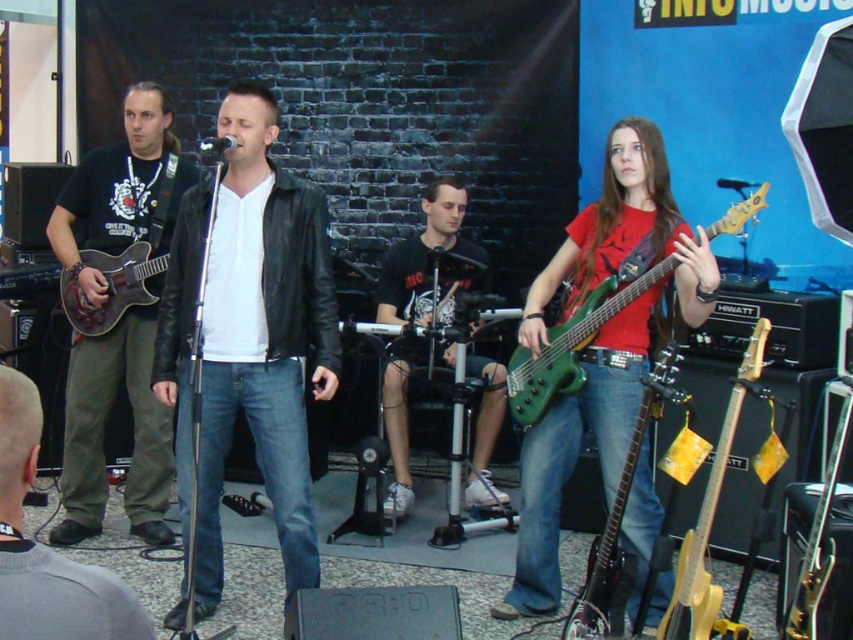
From the picture: Does black leather jacket at center have a larger size compared to green glossy bass guitar at center?

Yes, black leather jacket at center is bigger than green glossy bass guitar at center.

Who is shorter, black leather jacket at center or green glossy bass guitar at center?

green glossy bass guitar at center is shorter.

Who is more distant from viewer, (x=247, y=404) or (x=556, y=324)?

Point (x=556, y=324)

Identify the location of black leather jacket at center. The width and height of the screenshot is (853, 640). (263, 340).

Based on the photo, who is higher up, black leather jacket at center or matte black guitar at left?

Positioned higher is matte black guitar at left.

Can you confirm if black leather jacket at center is positioned to the left of matte black guitar at left?

No, black leather jacket at center is not to the left of matte black guitar at left.

Who is more distant from viewer, (292, 490) or (155, 529)?

The point (155, 529) is more distant.

Where is `black leather jacket at center`? This screenshot has width=853, height=640. black leather jacket at center is located at coordinates (263, 340).

Is black leather jacket at center taller than metallic gold electric guitar at center?

Indeed, black leather jacket at center has a greater height compared to metallic gold electric guitar at center.

Can you confirm if black leather jacket at center is smaller than metallic gold electric guitar at center?

No.

Is point (273, 488) farther from camera compared to point (795, 595)?

Yes, it is.

The image size is (853, 640). Identify the location of black leather jacket at center. (263, 340).